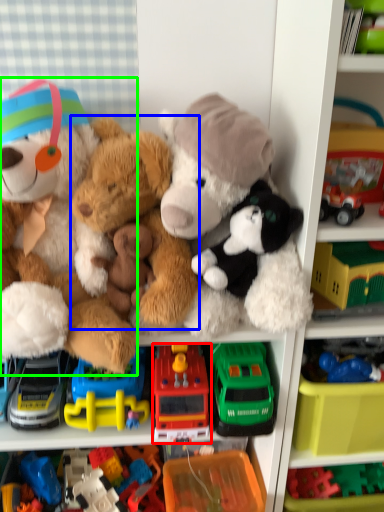
Question: Which is farther away from toy (highlighted by a red box)? teddy bear (highlighted by a blue box) or teddy bear (highlighted by a green box)?

Choices:
 (A) teddy bear
 (B) teddy bear

Answer: (B)